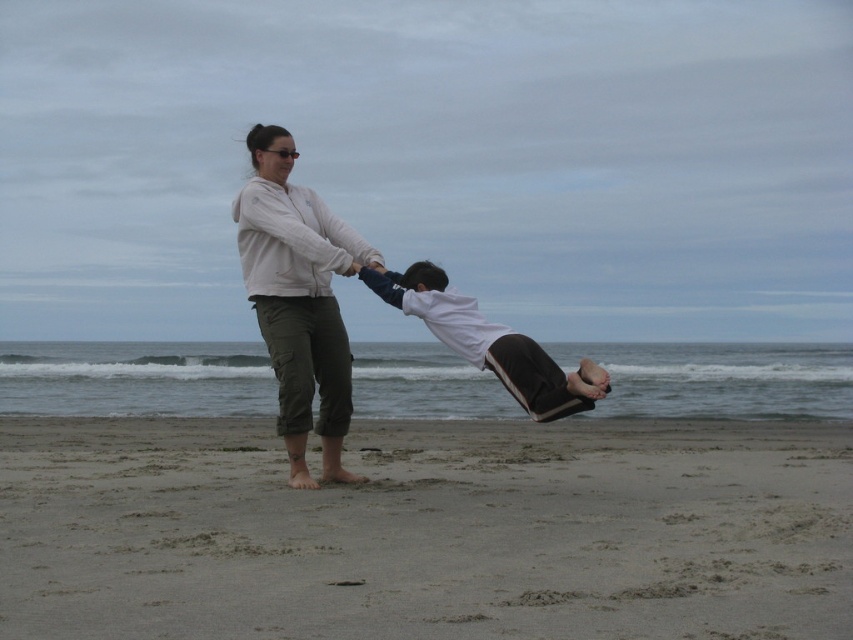
Question: Estimate the real-world distances between objects in this image. Which object is closer to the light pink fleece jacket at center?

Choices:
 (A) brown sandy beach at center
 (B) white cotton shirt at center

Answer: (B)

Question: Does light pink fleece jacket at center appear on the left side of white cotton shirt at center?

Choices:
 (A) yes
 (B) no

Answer: (A)

Question: Is brown sandy beach at center to the right of white cotton shirt at center from the viewer's perspective?

Choices:
 (A) yes
 (B) no

Answer: (B)

Question: Is brown sandy beach at center positioned before white cotton shirt at center?

Choices:
 (A) yes
 (B) no

Answer: (A)

Question: Which point is farther to the camera?

Choices:
 (A) (532, 387)
 (B) (782, 476)

Answer: (B)

Question: Which point is closer to the camera taking this photo?

Choices:
 (A) (322, 340)
 (B) (431, 291)

Answer: (B)